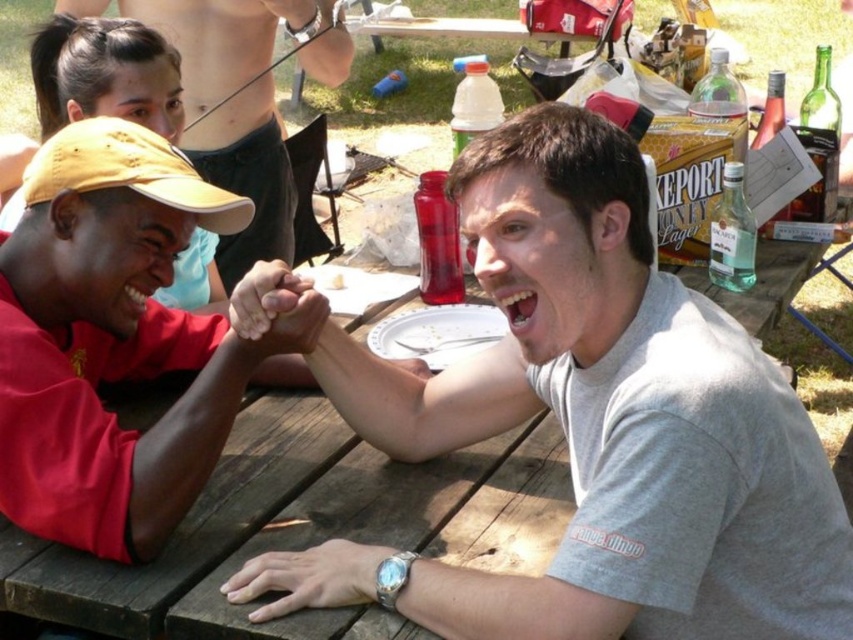
Is matte red shirt at left wider than silver metallic watch at lower center?

Yes, matte red shirt at left is wider than silver metallic watch at lower center.

Based on the photo, who is more distant from viewer, (50, 228) or (312, 554)?

Point (50, 228)

You are a GUI agent. You are given a task and a screenshot of the screen. Output one action in this format:
    pyautogui.click(x=<x>, y=<y>)
    Task: Click on the matte red shirt at left
    The height and width of the screenshot is (640, 853).
    Given the screenshot: What is the action you would take?
    pyautogui.click(x=115, y=349)

Can you confirm if gray matte t-shirt at center is thinner than matte red shirt at left?

Incorrect, gray matte t-shirt at center's width is not less than matte red shirt at left's.

Which is more to the left, gray matte t-shirt at center or matte red shirt at left?

matte red shirt at left

Describe the element at coordinates (608, 419) in the screenshot. The image size is (853, 640). I see `gray matte t-shirt at center` at that location.

Locate an element on the screen. gray matte t-shirt at center is located at coordinates (608, 419).

This screenshot has height=640, width=853. Describe the element at coordinates (129, 172) in the screenshot. I see `matte yellow baseball cap at upper left` at that location.

Is point (45, 150) positioned behind point (311, 310)?

Yes, point (45, 150) is behind point (311, 310).

The image size is (853, 640). Find the location of `matte yellow baseball cap at upper left`. matte yellow baseball cap at upper left is located at coordinates (129, 172).